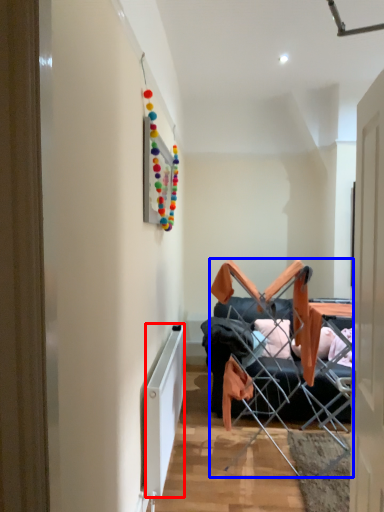
Question: Among these objects, which one is farthest to the camera, radiator (highlighted by a red box) or chair (highlighted by a blue box)?

Choices:
 (A) radiator
 (B) chair

Answer: (B)